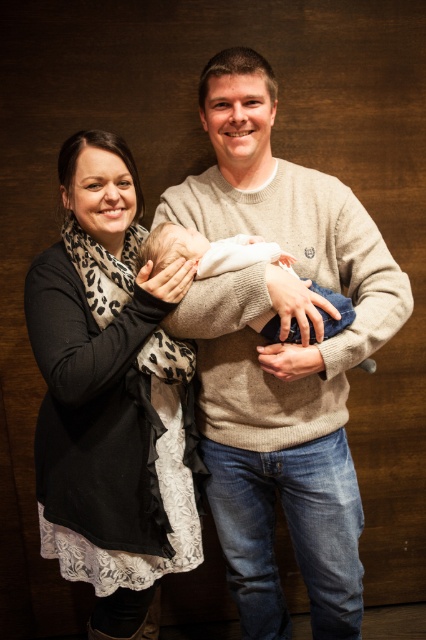
Can you confirm if knit sweater at center is taller than black leopard print scarf at left?

Yes, knit sweater at center is taller than black leopard print scarf at left.

Between point (265, 67) and point (138, 355), which one is positioned behind?

The point (265, 67) is more distant.

Which is behind, point (189, 214) or point (127, 513)?

Point (189, 214)

The image size is (426, 640). I want to click on knit sweater at center, so click(x=279, y=355).

Who is lower down, black leopard print scarf at left or white soft fabric newborn at center?

black leopard print scarf at left

Does black leopard print scarf at left lie behind white soft fabric newborn at center?

No.

Which is in front, point (149, 531) or point (164, 225)?

Point (164, 225)

Image resolution: width=426 pixels, height=640 pixels. I want to click on black leopard print scarf at left, so click(109, 394).

Is knit sweater at center further to camera compared to white soft fabric newborn at center?

Yes, it is.

Does knit sweater at center have a lesser height compared to white soft fabric newborn at center?

No.

Identify the location of knit sweater at center. (279, 355).